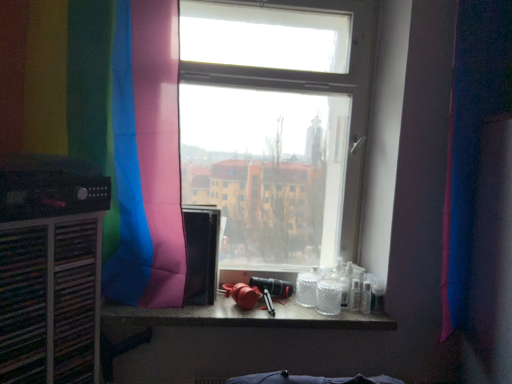
Describe the element at coordinates (471, 137) in the screenshot. I see `pink fabric curtain at right, the 1th curtain in the right-to-left sequence` at that location.

What do you see at coordinates (50, 187) in the screenshot? The width and height of the screenshot is (512, 384). I see `black matte speaker at left` at bounding box center [50, 187].

Describe the element at coordinates (245, 317) in the screenshot. Image resolution: width=512 pixels, height=384 pixels. I see `translucent glass counter top at center` at that location.

Find the location of a particular element. This screenshot has width=512, height=384. translucent glass counter top at center is located at coordinates (245, 317).

At what (x,y) coordinates should I click in order to perform the action: click on rainbow fabric curtain at left, the first curtain when ordered from left to right. Please return your answer as a coordinate pair (x, y). Looking at the image, I should click on (105, 123).

What are the coordinates of `pink fabric curtain at right, the 1th curtain in the right-to-left sequence` in the screenshot? It's located at (471, 137).

From a real-world perspective, between transparent glass window at center and translucent glass counter top at center, who is vertically higher?

transparent glass window at center, from a real-world perspective.

Which is in front, transparent glass window at center or translucent glass counter top at center?

Positioned in front is translucent glass counter top at center.

Does transparent glass window at center touch translucent glass counter top at center?

No.

Identify the location of counter top located in front of the transparent glass window at center. This screenshot has width=512, height=384. (245, 317).

Does pink fabric curtain at right, the second curtain from the left, turn towards rainbow fabric curtain at left, the first curtain when ordered from left to right?

No, pink fabric curtain at right, the second curtain from the left, is not oriented towards rainbow fabric curtain at left, the first curtain when ordered from left to right.

Considering the sizes of objects pink fabric curtain at right, the second curtain from the left, and rainbow fabric curtain at left, the first curtain when ordered from left to right, in the image provided, who is taller, pink fabric curtain at right, the second curtain from the left, or rainbow fabric curtain at left, the first curtain when ordered from left to right,?

pink fabric curtain at right, the second curtain from the left, is taller.

Measure the distance between pink fabric curtain at right, the 1th curtain in the right-to-left sequence, and rainbow fabric curtain at left, the first curtain when ordered from left to right.

pink fabric curtain at right, the 1th curtain in the right-to-left sequence, and rainbow fabric curtain at left, the first curtain when ordered from left to right, are 38.54 inches apart.

From the image's perspective, is pink fabric curtain at right, the second curtain from the left, above or below rainbow fabric curtain at left, which appears as the second curtain when viewed from the right?

pink fabric curtain at right, the second curtain from the left, is below rainbow fabric curtain at left, which appears as the second curtain when viewed from the right.

How many degrees apart are the facing directions of rainbow fabric curtain at left, which appears as the second curtain when viewed from the right, and black matte speaker at left?

58.9 degrees separate the facing orientations of rainbow fabric curtain at left, which appears as the second curtain when viewed from the right, and black matte speaker at left.

From their relative heights in the image, would you say rainbow fabric curtain at left, which appears as the second curtain when viewed from the right, is taller or shorter than black matte speaker at left?

Clearly, rainbow fabric curtain at left, which appears as the second curtain when viewed from the right, is taller compared to black matte speaker at left.

From a real-world perspective, is rainbow fabric curtain at left, the first curtain when ordered from left to right, over black matte speaker at left?

Yes, from a real-world perspective, rainbow fabric curtain at left, the first curtain when ordered from left to right, is over black matte speaker at left

Based on the photo, is transparent glass window at center facing away from pink fabric curtain at right, the 1th curtain in the right-to-left sequence?

That's not correct — transparent glass window at center is not looking away from pink fabric curtain at right, the 1th curtain in the right-to-left sequence.

Does transparent glass window at center have a greater height compared to pink fabric curtain at right, the second curtain from the left?

In fact, transparent glass window at center may be shorter than pink fabric curtain at right, the second curtain from the left.

From the image's perspective, is transparent glass window at center beneath pink fabric curtain at right, the 1th curtain in the right-to-left sequence?

No.

Is point (204, 141) closer to viewer compared to point (472, 164)?

No, (204, 141) is behind (472, 164).

Is black matte speaker at left not near translucent glass counter top at center?

They are positioned close to each other.

Can translucent glass counter top at center be found inside black matte speaker at left?

No, translucent glass counter top at center is located outside of black matte speaker at left.

What's the angular difference between black matte speaker at left and translucent glass counter top at center's facing directions?

The facing directions of black matte speaker at left and translucent glass counter top at center are 58.9 degrees apart.

Who is shorter, black matte speaker at left or translucent glass counter top at center?

Standing shorter between the two is translucent glass counter top at center.

Between point (2, 126) and point (286, 171), which one is positioned behind?

The point (286, 171) is behind.

Is rainbow fabric curtain at left, which appears as the second curtain when viewed from the right, shorter than transparent glass window at center?

Indeed, rainbow fabric curtain at left, which appears as the second curtain when viewed from the right, has a lesser height compared to transparent glass window at center.

Looking at the image, does rainbow fabric curtain at left, which appears as the second curtain when viewed from the right, seem bigger or smaller compared to transparent glass window at center?

rainbow fabric curtain at left, which appears as the second curtain when viewed from the right, is smaller than transparent glass window at center.

Does rainbow fabric curtain at left, which appears as the second curtain when viewed from the right, have a greater width compared to transparent glass window at center?

In fact, rainbow fabric curtain at left, which appears as the second curtain when viewed from the right, might be narrower than transparent glass window at center.

Considering the sizes of objects black matte speaker at left and rainbow fabric curtain at left, the first curtain when ordered from left to right, in the image provided, who is smaller, black matte speaker at left or rainbow fabric curtain at left, the first curtain when ordered from left to right,?

With smaller size is black matte speaker at left.

This screenshot has width=512, height=384. Find the location of `appliance below the rainbow fabric curtain at left, the first curtain when ordered from left to right (from a real-world perspective)`. appliance below the rainbow fabric curtain at left, the first curtain when ordered from left to right (from a real-world perspective) is located at coordinates (50, 187).

Considering the relative sizes of black matte speaker at left and rainbow fabric curtain at left, the first curtain when ordered from left to right, in the image provided, is black matte speaker at left shorter than rainbow fabric curtain at left, the first curtain when ordered from left to right,?

Yes.

In the scene shown: From the image's perspective, between black matte speaker at left and rainbow fabric curtain at left, the first curtain when ordered from left to right, who is located below?

From the image's view, black matte speaker at left is below.

What are the coordinates of `window lying behind the translucent glass counter top at center` in the screenshot? It's located at (276, 126).

Locate an element on the screen. curtain below the rainbow fabric curtain at left, which appears as the second curtain when viewed from the right (from a real-world perspective) is located at coordinates (471, 137).

Considering their positions, is pink fabric curtain at right, the second curtain from the left, positioned closer to black matte speaker at left than rainbow fabric curtain at left, which appears as the second curtain when viewed from the right?

rainbow fabric curtain at left, which appears as the second curtain when viewed from the right, is positioned closer to the anchor black matte speaker at left.

Based on their spatial positions, is rainbow fabric curtain at left, which appears as the second curtain when viewed from the right, or black matte speaker at left closer to transparent glass window at center?

rainbow fabric curtain at left, which appears as the second curtain when viewed from the right, lies closer to transparent glass window at center than the other object.

Estimate the real-world distances between objects in this image. Which object is closer to translucent glass counter top at center, black matte speaker at left or pink fabric curtain at right, the 1th curtain in the right-to-left sequence?

The object closer to translucent glass counter top at center is black matte speaker at left.

Considering their positions, is translucent glass counter top at center positioned closer to transparent glass window at center than black matte speaker at left?

The object closer to transparent glass window at center is translucent glass counter top at center.

Looking at the image, which one is located further to black matte speaker at left, translucent glass counter top at center or rainbow fabric curtain at left, the first curtain when ordered from left to right?

translucent glass counter top at center is further to black matte speaker at left.

Looking at the image, which one is located closer to black matte speaker at left, translucent glass counter top at center or pink fabric curtain at right, the second curtain from the left?

translucent glass counter top at center is closer to black matte speaker at left.

From the image, which object appears to be nearer to black matte speaker at left, translucent glass counter top at center or transparent glass window at center?

The object closer to black matte speaker at left is translucent glass counter top at center.

From the image, which object appears to be farther from pink fabric curtain at right, the second curtain from the left, translucent glass counter top at center or black matte speaker at left?

black matte speaker at left is further to pink fabric curtain at right, the second curtain from the left.

The image size is (512, 384). In order to click on window located between black matte speaker at left and pink fabric curtain at right, the 1th curtain in the right-to-left sequence, in the left-right direction in this screenshot , I will do `click(276, 126)`.

Find the location of a particular element. The image size is (512, 384). curtain situated between black matte speaker at left and pink fabric curtain at right, the 1th curtain in the right-to-left sequence, from left to right is located at coordinates (105, 123).

Find the location of a particular element. This screenshot has width=512, height=384. counter top located between black matte speaker at left and pink fabric curtain at right, the second curtain from the left, in the left-right direction is located at coordinates (245, 317).

At what (x,y) coordinates should I click in order to perform the action: click on window located between rainbow fabric curtain at left, the first curtain when ordered from left to right, and pink fabric curtain at right, the 1th curtain in the right-to-left sequence, in the left-right direction. Please return your answer as a coordinate pair (x, y). Image resolution: width=512 pixels, height=384 pixels. Looking at the image, I should click on (276, 126).